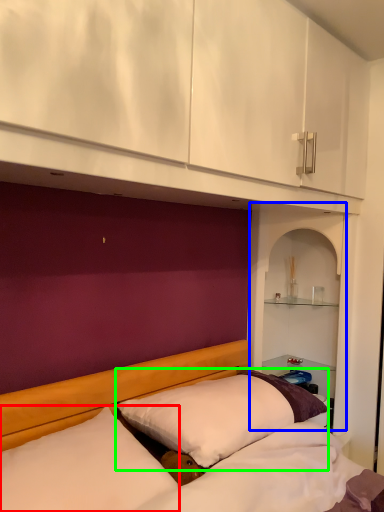
Question: Which object is the closest to the pillow (highlighted by a red box)? Choose among these: shelf (highlighted by a blue box) or pillow (highlighted by a green box).

Choices:
 (A) shelf
 (B) pillow

Answer: (B)